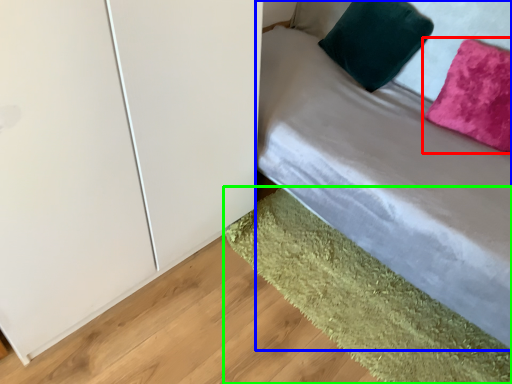
Question: Which is nearer to the pillow (highlighted by a red box)? bed (highlighted by a blue box) or mat (highlighted by a green box).

Choices:
 (A) bed
 (B) mat

Answer: (A)